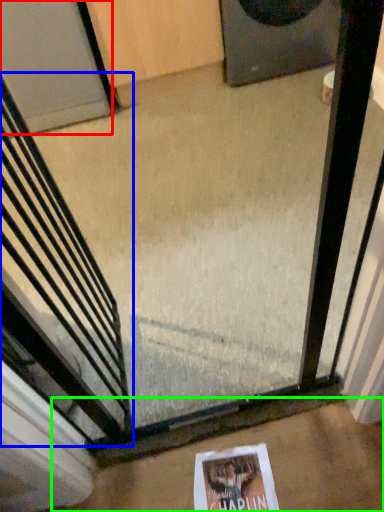
Question: Which is farther away from door (highlighted by a red box)? escalator (highlighted by a blue box) or concrete (highlighted by a green box)?

Choices:
 (A) escalator
 (B) concrete

Answer: (B)